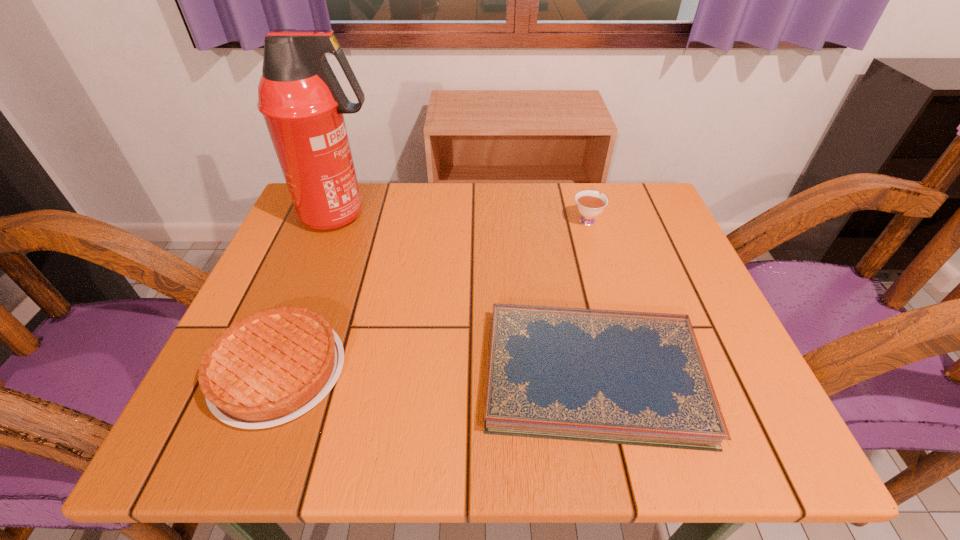
Locate which object ranks third in proximity to the paperback book. Please provide its 2D coordinates. Your answer should be formatted as a tuple, i.e. [(x, y)], where the tuple contains the x and y coordinates of a point satisfying the conditions above.

[(302, 102)]

What are the coordinates of `vacant space that satisfies the following two spatial constraints: 1. on the back side of the paperback book; 2. on the trigger side of the fire extinguisher` in the screenshot? It's located at (559, 215).

Locate an element on the screen. The image size is (960, 540). vacant space that satisfies the following two spatial constraints: 1. on the trigger side of the fire extinguisher; 2. on the side of the teacup with the handle is located at coordinates (340, 220).

The image size is (960, 540). What are the coordinates of `vacant area in the image that satisfies the following two spatial constraints: 1. on the trigger side of the tallest object; 2. on the front side of the third tallest object` in the screenshot? It's located at (282, 371).